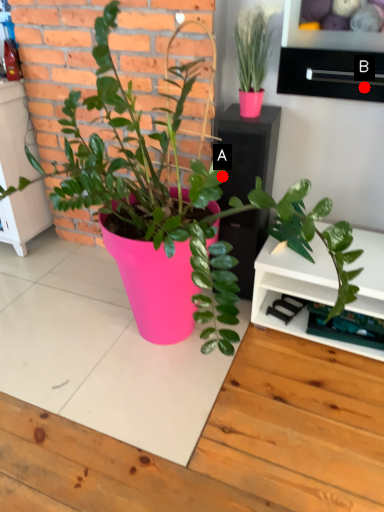
Question: Two points are circled on the image, labeled by A and B beside each circle. Which point appears closest to the camera in this image?

Choices:
 (A) A is closer
 (B) B is closer

Answer: (B)